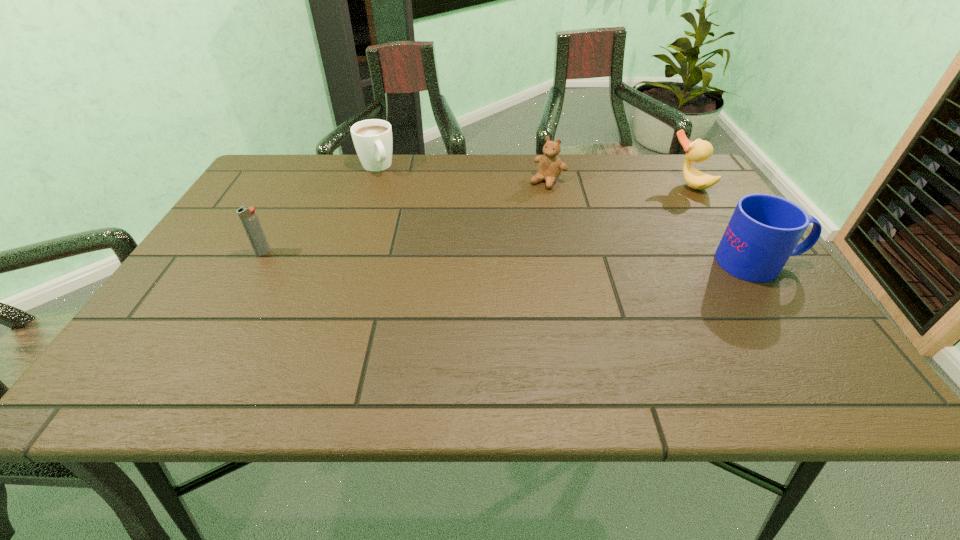
You are a GUI agent. You are given a task and a screenshot of the screen. Output one action in this format:
    pyautogui.click(x=<x>, y=<y>)
    Task: Click on the free space on the desktop that is between the leftmost object and the mug and is positioned on the beak of the duck
    The width and height of the screenshot is (960, 540).
    Given the screenshot: What is the action you would take?
    pyautogui.click(x=567, y=259)

Identify the location of vacant space on the desktop that is between the leftmost object and the mug and is positioned with the handle on the side of the second object from left to right. (436, 256).

Find the location of a particular element. vacant spot on the desktop that is between the igniter and the mug and is positioned on the face of the teddy bear is located at coordinates (476, 256).